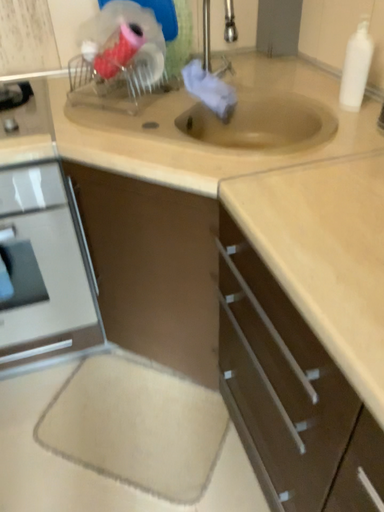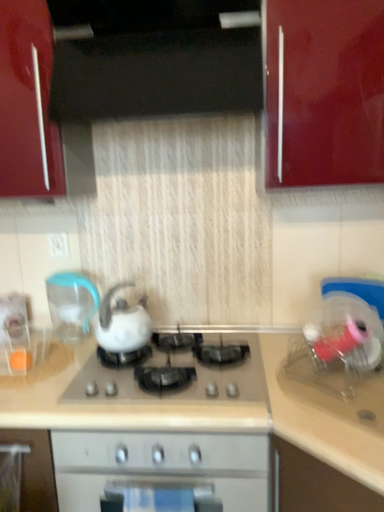
Question: Which way did the camera rotate in the video?

Choices:
 (A) rotated upward
 (B) rotated downward

Answer: (A)